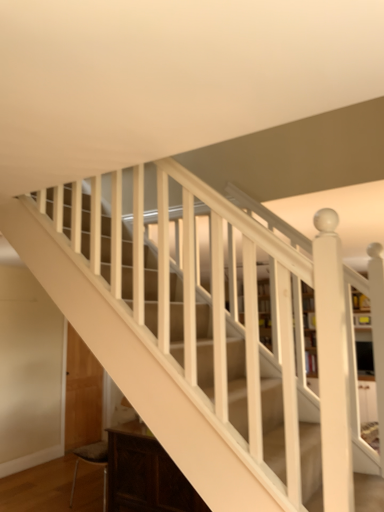
Image resolution: width=384 pixels, height=512 pixels. Identify the location of dark wood cabinet at lower left. (145, 474).

Describe the element at coordinates (145, 474) in the screenshot. I see `dark wood cabinet at lower left` at that location.

Image resolution: width=384 pixels, height=512 pixels. What do you see at coordinates (309, 330) in the screenshot? I see `wooden bookcase at center` at bounding box center [309, 330].

Measure the distance between wooden bookcase at center and camera.

wooden bookcase at center and camera are 4.25 feet apart from each other.

Where is `wooden bookcase at center`? wooden bookcase at center is located at coordinates (309, 330).

This screenshot has height=512, width=384. I want to click on dark wood cabinet at lower left, so click(145, 474).

Can you confirm if wooden bookcase at center is positioned to the left of dark wood cabinet at lower left?

In fact, wooden bookcase at center is to the right of dark wood cabinet at lower left.

Which is in front, wooden bookcase at center or dark wood cabinet at lower left?

dark wood cabinet at lower left.

Which is less distant, (309, 290) or (149, 511)?

Point (309, 290) is positioned closer to the camera compared to point (149, 511).

From the image's perspective, is wooden bookcase at center located above or below dark wood cabinet at lower left?

Based on their image positions, wooden bookcase at center is located above dark wood cabinet at lower left.

Consider the image. From a real-world perspective, which object stands above the other?

wooden bookcase at center is physically above.

Considering the sizes of objects wooden bookcase at center and dark wood cabinet at lower left in the image provided, who is wider, wooden bookcase at center or dark wood cabinet at lower left?

dark wood cabinet at lower left is wider.

Who is shorter, wooden bookcase at center or dark wood cabinet at lower left?

Standing shorter between the two is dark wood cabinet at lower left.

Can you confirm if wooden bookcase at center is smaller than dark wood cabinet at lower left?

No, wooden bookcase at center is not smaller than dark wood cabinet at lower left.

Would you say wooden bookcase at center is outside dark wood cabinet at lower left?

Yes, wooden bookcase at center is located beyond the bounds of dark wood cabinet at lower left.

Is wooden bookcase at center not near dark wood cabinet at lower left?

Absolutely, wooden bookcase at center is distant from dark wood cabinet at lower left.

Is dark wood cabinet at lower left at the back of wooden bookcase at center?

No.

Where is `bookcase behind the dark wood cabinet at lower left`? The height and width of the screenshot is (512, 384). bookcase behind the dark wood cabinet at lower left is located at coordinates (309, 330).

Based on the photo, considering the relative positions of dark wood cabinet at lower left and wooden bookcase at center in the image provided, is dark wood cabinet at lower left to the left of wooden bookcase at center from the viewer's perspective?

Indeed, dark wood cabinet at lower left is positioned on the left side of wooden bookcase at center.

Which object is closer to the camera, dark wood cabinet at lower left or wooden bookcase at center?

dark wood cabinet at lower left is more forward.

Which is behind, point (129, 511) or point (361, 360)?

Point (129, 511)

From the image's perspective, which object appears higher, dark wood cabinet at lower left or wooden bookcase at center?

wooden bookcase at center, from the image's perspective.

From a real-world perspective, is dark wood cabinet at lower left positioned over wooden bookcase at center based on gravity?

No, from a real-world perspective, dark wood cabinet at lower left is not on top of wooden bookcase at center.

Does dark wood cabinet at lower left have a lesser width compared to wooden bookcase at center?

No.

Is dark wood cabinet at lower left taller or shorter than wooden bookcase at center?

Considering their sizes, dark wood cabinet at lower left has less height than wooden bookcase at center.

Is dark wood cabinet at lower left bigger than wooden bookcase at center?

Actually, dark wood cabinet at lower left might be smaller than wooden bookcase at center.

Is dark wood cabinet at lower left located outside wooden bookcase at center?

Yes, dark wood cabinet at lower left is located beyond the bounds of wooden bookcase at center.

Are dark wood cabinet at lower left and wooden bookcase at center far apart?

Absolutely, dark wood cabinet at lower left is distant from wooden bookcase at center.

Is dark wood cabinet at lower left turned away from wooden bookcase at center?

Yes, dark wood cabinet at lower left's orientation is away from wooden bookcase at center.

Locate an element on the screen. furniture located underneath the wooden bookcase at center (from a real-world perspective) is located at coordinates (145, 474).

Locate an element on the screen. bookcase to the right of dark wood cabinet at lower left is located at coordinates (309, 330).

Find the location of a particular element. furniture in front of the wooden bookcase at center is located at coordinates [145, 474].